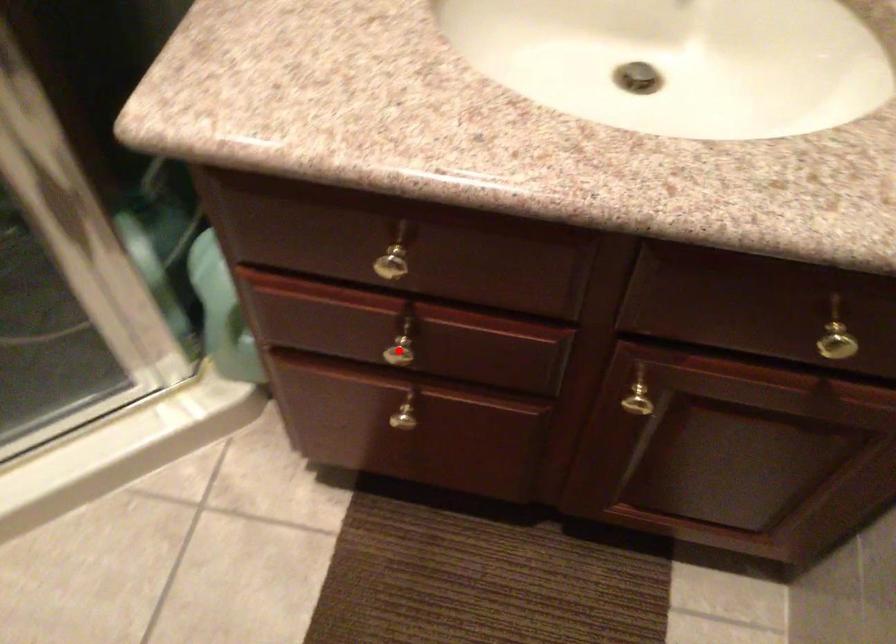
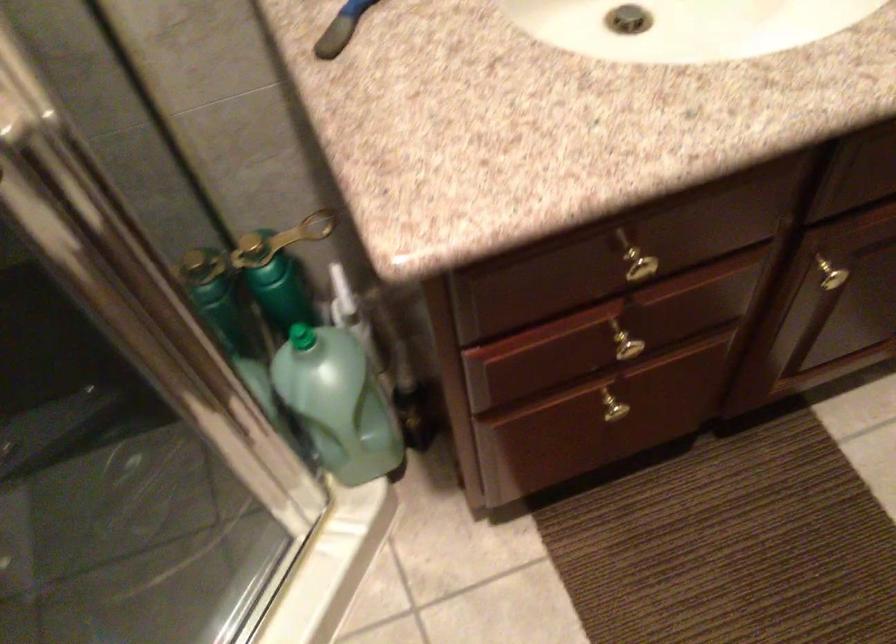
Find the pixel in the second image that matches the highlighted location in the first image.

(625, 346)